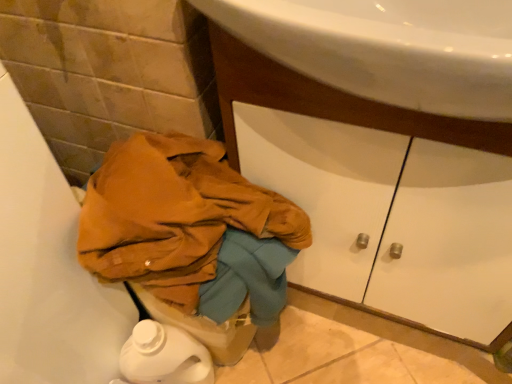
Question: Can you confirm if white matte drawer at center is taller than matte orange fabric at lower left?

Choices:
 (A) no
 (B) yes

Answer: (A)

Question: Is white matte drawer at center at the right side of matte orange fabric at lower left?

Choices:
 (A) no
 (B) yes

Answer: (B)

Question: Can you confirm if white matte drawer at center is bigger than matte orange fabric at lower left?

Choices:
 (A) yes
 (B) no

Answer: (B)

Question: Could matte orange fabric at lower left be considered to be inside white matte drawer at center?

Choices:
 (A) yes
 (B) no

Answer: (B)

Question: Is matte orange fabric at lower left at the back of white matte drawer at center?

Choices:
 (A) no
 (B) yes

Answer: (A)

Question: From a real-world perspective, is white matte drawer at center positioned over matte orange fabric at lower left based on gravity?

Choices:
 (A) yes
 (B) no

Answer: (A)

Question: Could white matte drawer at center be considered to be inside matte orange fabric at lower left?

Choices:
 (A) no
 (B) yes

Answer: (A)

Question: From a real-world perspective, is matte orange fabric at lower left beneath white matte drawer at center?

Choices:
 (A) yes
 (B) no

Answer: (A)

Question: Can you confirm if matte orange fabric at lower left is shorter than white matte drawer at center?

Choices:
 (A) yes
 (B) no

Answer: (B)

Question: Would you say matte orange fabric at lower left is outside white matte drawer at center?

Choices:
 (A) yes
 (B) no

Answer: (A)

Question: Is matte orange fabric at lower left positioned before white matte drawer at center?

Choices:
 (A) no
 (B) yes

Answer: (B)

Question: Can you confirm if matte orange fabric at lower left is positioned to the right of white matte drawer at center?

Choices:
 (A) no
 (B) yes

Answer: (A)

Question: Based on their sizes in the image, would you say white matte drawer at center is bigger or smaller than matte orange fabric at lower left?

Choices:
 (A) small
 (B) big

Answer: (A)